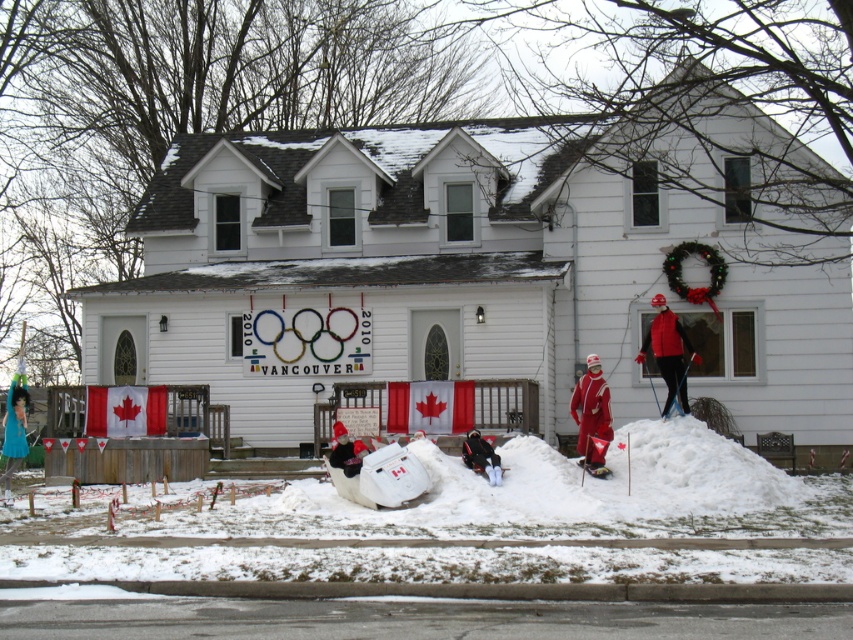
Between teal fabric dress at lower left and white plastic sled at lower center, which one is positioned higher?

teal fabric dress at lower left

Is teal fabric dress at lower left behind white plastic sled at lower center?

Yes, teal fabric dress at lower left is behind white plastic sled at lower center.

Find the location of `teal fabric dress at lower left`. teal fabric dress at lower left is located at coordinates [15, 429].

Between matte red ski suit at center and teal fabric dress at lower left, which one appears on the right side from the viewer's perspective?

From the viewer's perspective, matte red ski suit at center appears more on the right side.

Can you confirm if matte red ski suit at center is positioned below teal fabric dress at lower left?

No.

Where is `matte red ski suit at center`? This screenshot has width=853, height=640. matte red ski suit at center is located at coordinates (590, 413).

The height and width of the screenshot is (640, 853). Find the location of `matte red ski suit at center`. matte red ski suit at center is located at coordinates click(590, 413).

Is point (410, 518) closer to viewer compared to point (473, 442)?

Yes, it is.

Who is taller, white fluffy snow at lower center or white plastic sled at lower center?

With more height is white fluffy snow at lower center.

Which is in front, point (376, 522) or point (469, 444)?

Point (376, 522) is more forward.

This screenshot has width=853, height=640. In order to click on white fluffy snow at lower center in this screenshot , I will do `click(555, 497)`.